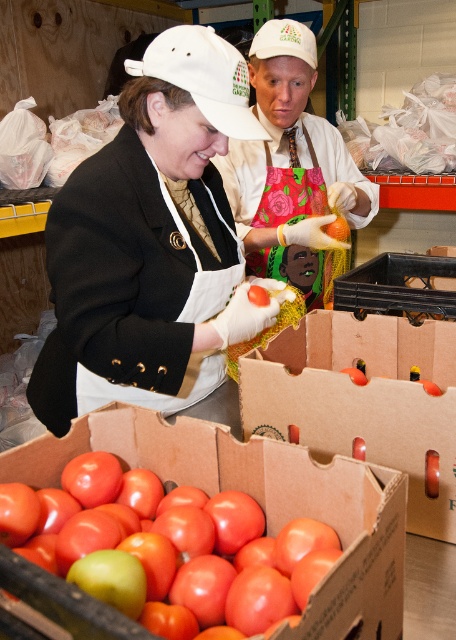
You are a worker in the food distribution area. You see the white matte apron at center and the cardboard box at lower center. Which object is positioned higher in the image?

The white matte apron at center is above the cardboard box at lower center, so it is positioned higher in the image.